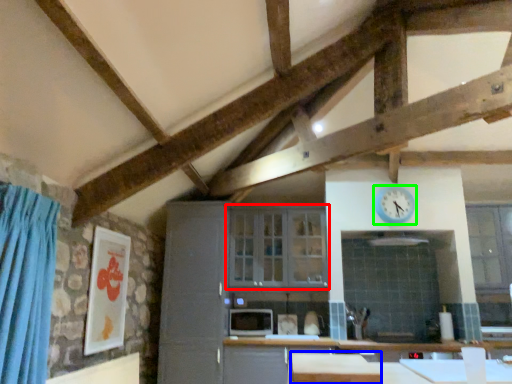
Question: Which is nearer to the window (highlighted by a red box)? table (highlighted by a blue box) or clock (highlighted by a green box).

Choices:
 (A) table
 (B) clock

Answer: (B)